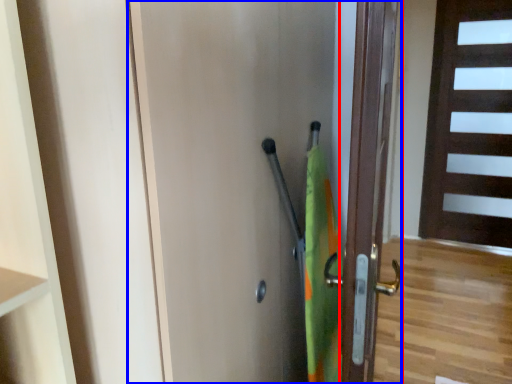
Question: Which point is closer to the camera, door (highlighted by a red box) or door (highlighted by a blue box)?

Choices:
 (A) door
 (B) door

Answer: (B)